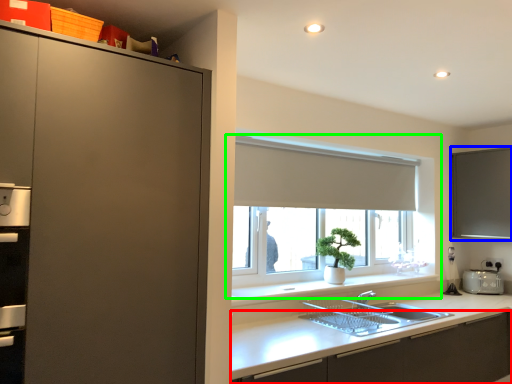
Question: Based on their relative distances, which object is nearer to cabinetry (highlighted by a red box)? Choose from window screen (highlighted by a blue box) and window (highlighted by a green box).

Choices:
 (A) window screen
 (B) window

Answer: (B)